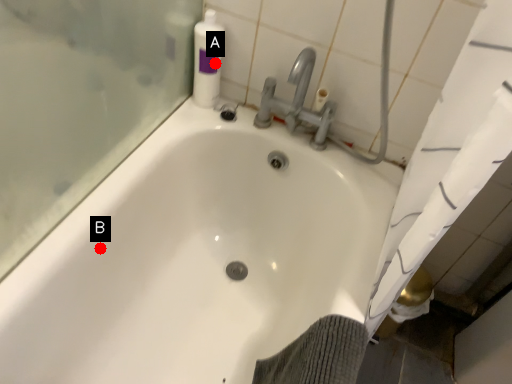
Question: Two points are circled on the image, labeled by A and B beside each circle. Which point is closer to the camera taking this photo?

Choices:
 (A) A is closer
 (B) B is closer

Answer: (B)